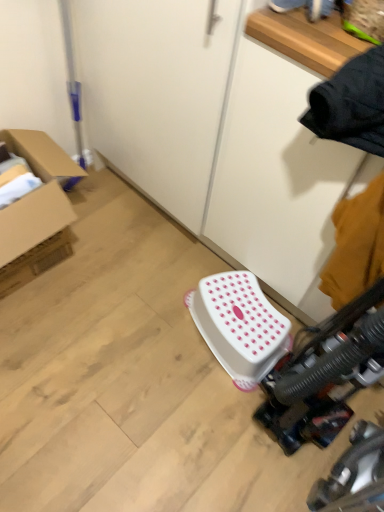
Identify the location of free space in front of white plastic stool at center. (216, 411).